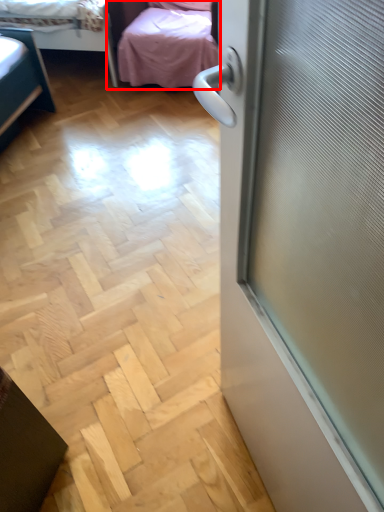
Question: Observing the image, what is the correct spatial positioning of studio couch (annotated by the red box) in reference to bed?

Choices:
 (A) left
 (B) right

Answer: (B)